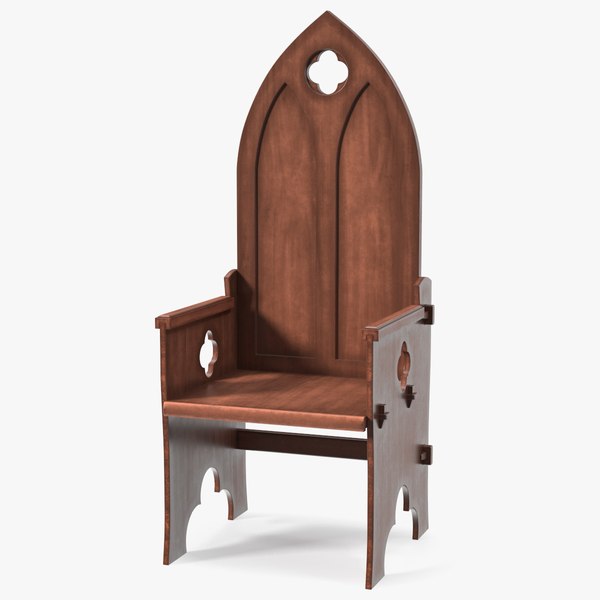
Locate an element on the screen. dark wooden throne is located at coordinates (281, 386).